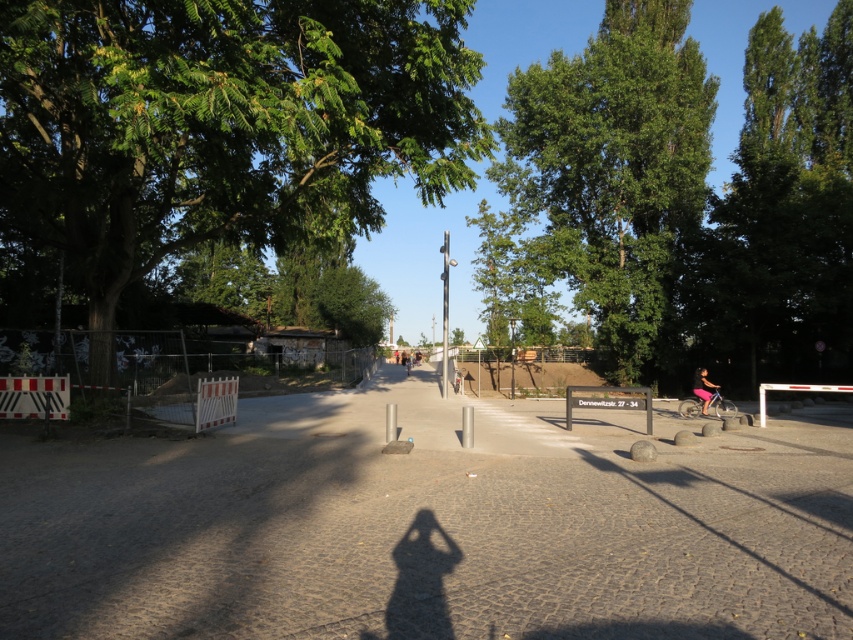
Question: Is smooth metal pole at center thinner than pink fabric bicycle at lower right?

Choices:
 (A) yes
 (B) no

Answer: (A)

Question: From the image, what is the correct spatial relationship of metallic gray sign at center in relation to white plastic barricade at lower right?

Choices:
 (A) above
 (B) below

Answer: (B)

Question: Which object appears farthest from the camera in this image?

Choices:
 (A) white plastic barricade at lower right
 (B) smooth metal pole at center
 (C) dirt track at center
 (D) green leafy tree at center

Answer: (D)

Question: Which point is closer to the camera?

Choices:
 (A) white plastic barricade at lower right
 (B) dirt track at center
 (C) smooth metal pole at center

Answer: (B)

Question: Which object is positioned closest to the dirt track at center?

Choices:
 (A) pink fabric bicycle at lower right
 (B) metallic gray sign at center
 (C) green leafy tree at left

Answer: (B)

Question: Is the position of green leafy tree at left more distant than that of metallic gray sign at center?

Choices:
 (A) no
 (B) yes

Answer: (A)